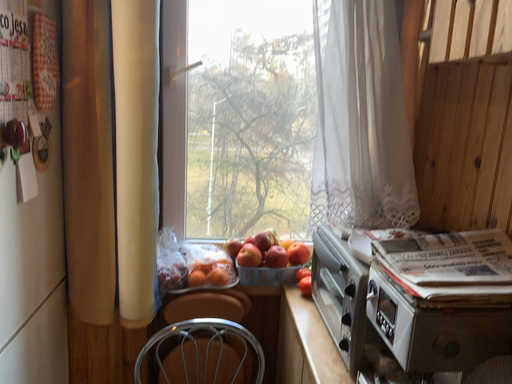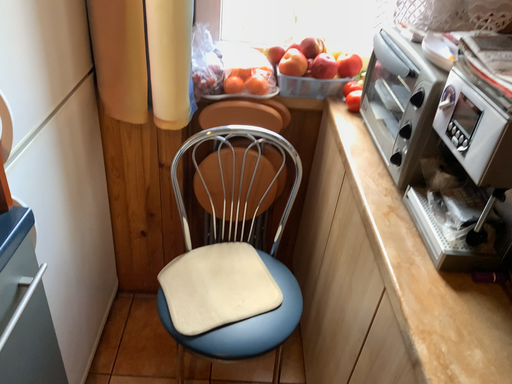
Question: Which way did the camera rotate in the video?

Choices:
 (A) rotated downward
 (B) rotated upward

Answer: (A)